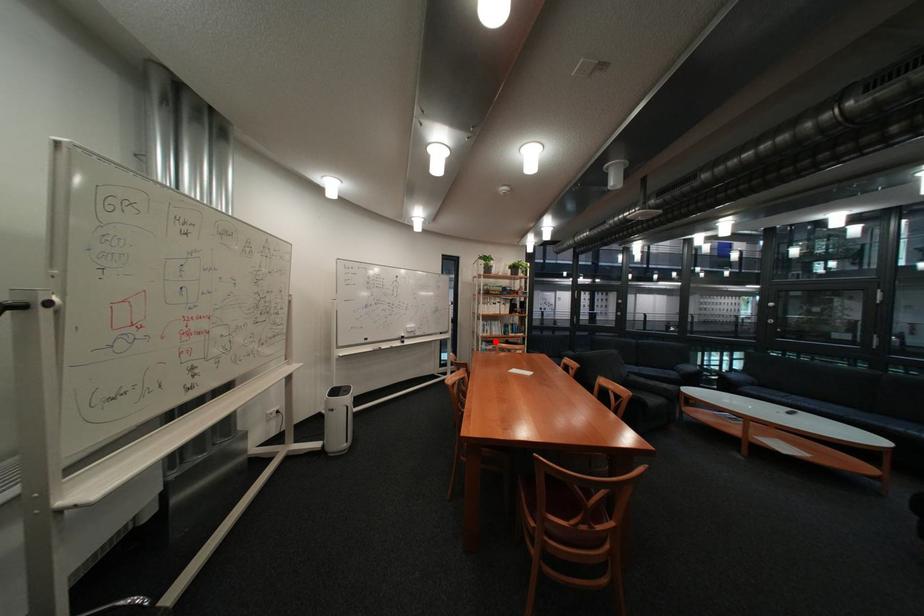
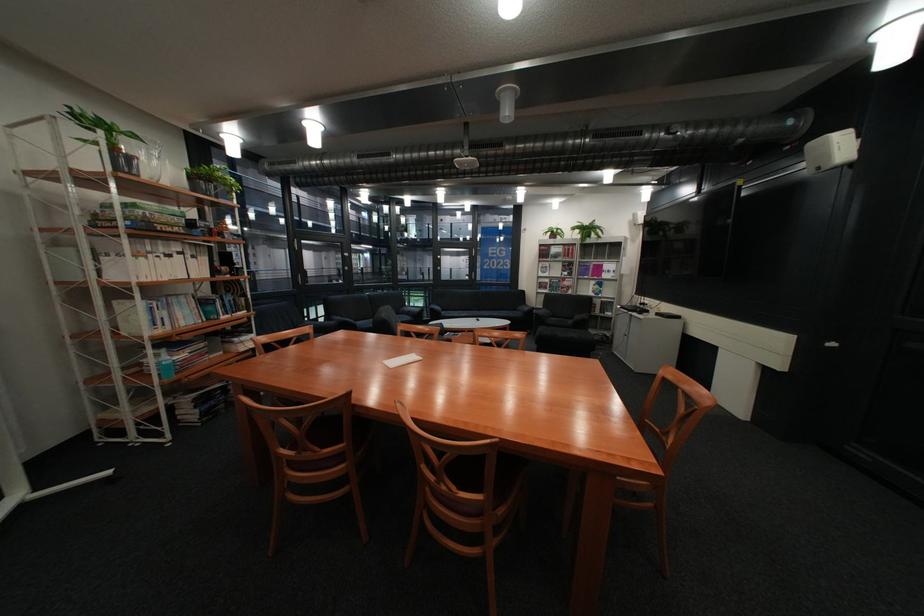
Question: I am providing you with two images of the same scene from different viewpoints. Given a red point in image1, look at the same physical point in image2. Is it:

Choices:
 (A) Closer to the viewpoint
 (B) Farther from the viewpoint

Answer: (A)